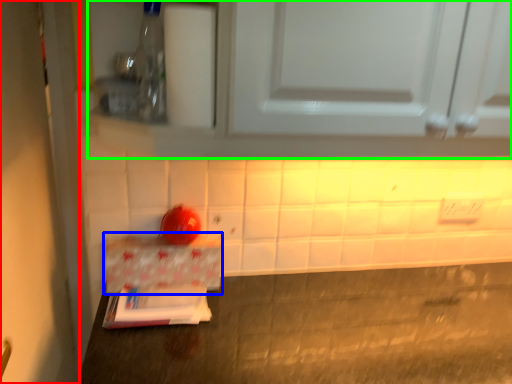
Question: Which is nearer to the door (highlighted by a red box)? cardboard box (highlighted by a blue box) or cabinetry (highlighted by a green box).

Choices:
 (A) cardboard box
 (B) cabinetry

Answer: (A)